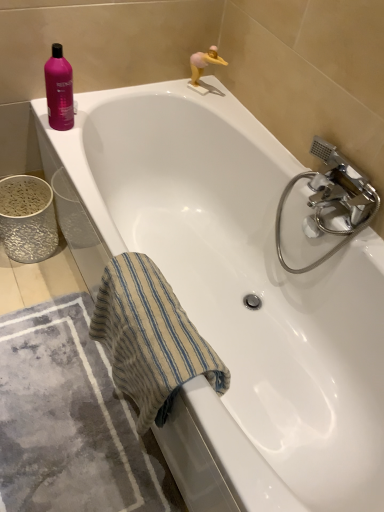
Question: From the image's perspective, is beige striped towel at lower left positioned above or below pink glossy shampoo at upper left?

Choices:
 (A) above
 (B) below

Answer: (B)

Question: Based on their positions, is beige striped towel at lower left located to the left or right of pink glossy shampoo at upper left?

Choices:
 (A) right
 (B) left

Answer: (A)

Question: Estimate the real-world distances between objects in this image. Which object is farther from the gray textured bath mat at lower left?

Choices:
 (A) beige striped towel at lower left
 (B) pink matte figurine at upper right
 (C) chrome metallic faucet at right
 (D) pink glossy shampoo at upper left

Answer: (B)

Question: Which object is the closest to the pink matte figurine at upper right?

Choices:
 (A) beige striped towel at lower left
 (B) gray textured bath mat at lower left
 (C) chrome metallic faucet at right
 (D) pink glossy shampoo at upper left

Answer: (D)